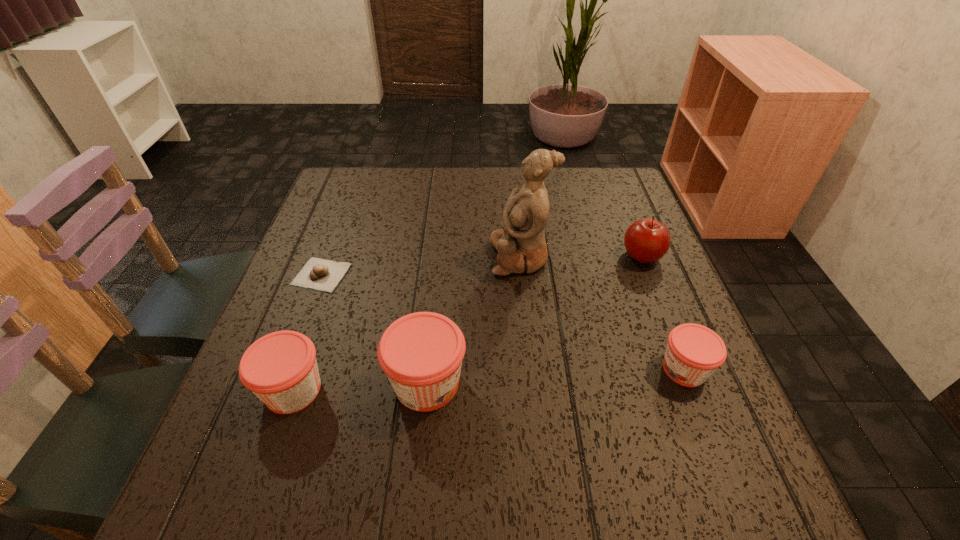
I want to click on free space for an extra jam to achieve even spacing, so click(x=558, y=376).